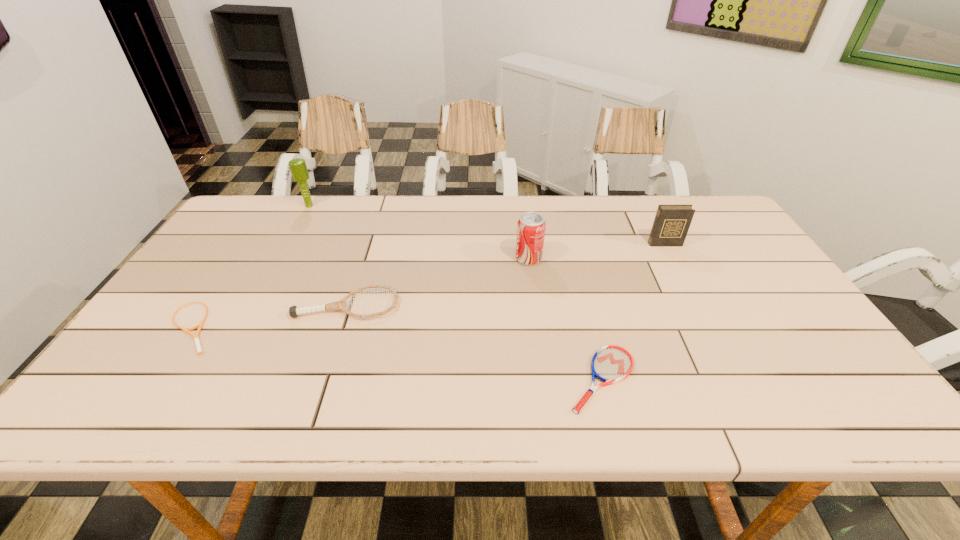
This screenshot has width=960, height=540. I want to click on object that is positioned at the left edge, so click(x=196, y=337).

In the image, there is a desktop. Identify the location of vacant space at the far edge. (645, 213).

The width and height of the screenshot is (960, 540). Identify the location of blank space at the near edge. (372, 387).

The height and width of the screenshot is (540, 960). I want to click on vacant region at the left edge of the desktop, so click(122, 360).

Find the location of a particular element. The image size is (960, 540). free spot at the right edge of the desktop is located at coordinates (718, 274).

This screenshot has width=960, height=540. Find the location of `free region at the far left corner of the desktop`. free region at the far left corner of the desktop is located at coordinates (249, 198).

This screenshot has width=960, height=540. In the image, there is a desktop. Identify the location of vacant space at the far right corner. (733, 226).

You are a GUI agent. You are given a task and a screenshot of the screen. Output one action in this format:
    pyautogui.click(x=<x>, y=<y>)
    Task: Click on the vacant space at the near right corner
    The width and height of the screenshot is (960, 540).
    Given the screenshot: What is the action you would take?
    pyautogui.click(x=860, y=406)

Where is `blank region between the fifth object from right to left and the shortest object`? blank region between the fifth object from right to left and the shortest object is located at coordinates (251, 266).

Where is `free space that is in between the farthest object and the second farthest object`? Image resolution: width=960 pixels, height=540 pixels. free space that is in between the farthest object and the second farthest object is located at coordinates (487, 225).